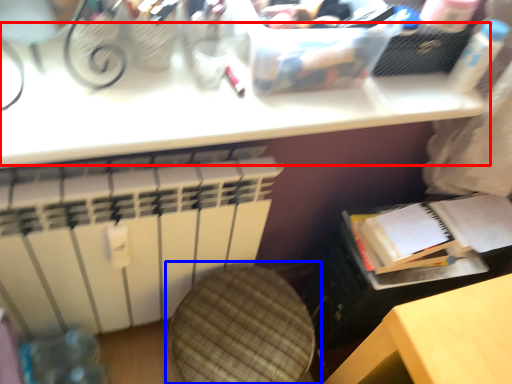
Question: Which point is closer to the camera, table (highlighted by a red box) or swivel chair (highlighted by a blue box)?

Choices:
 (A) table
 (B) swivel chair

Answer: (A)